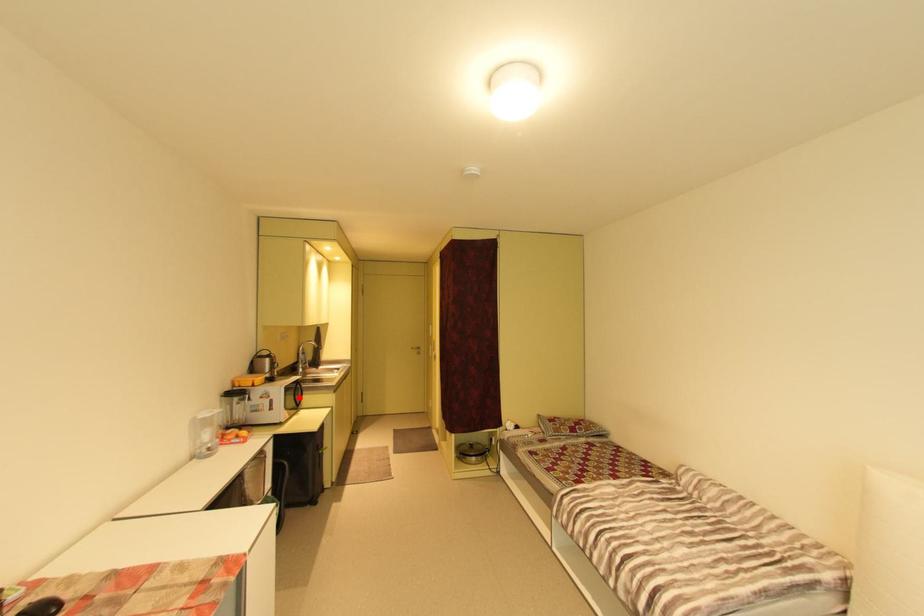
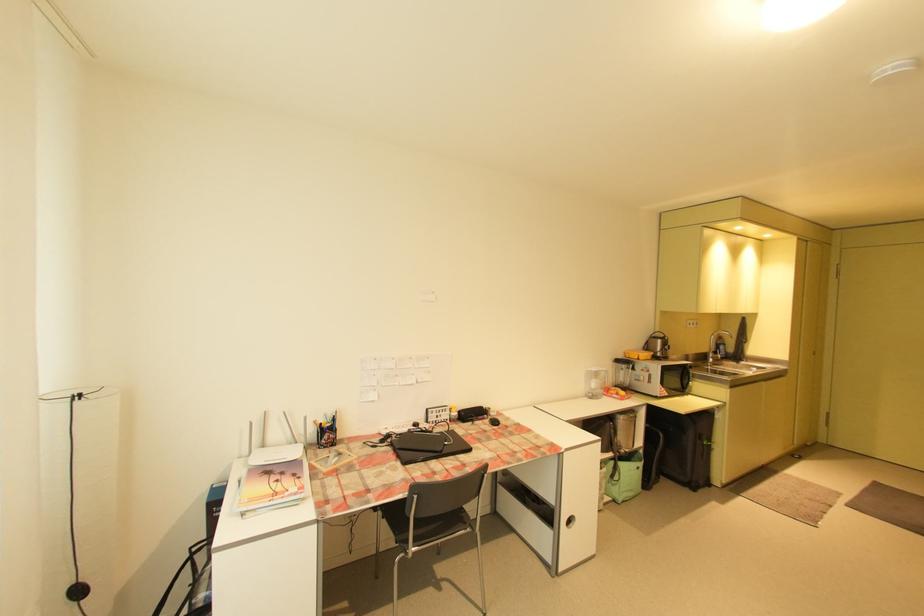
Question: I am providing you with two images of the same scene from different viewpoints. In image1, a red point is highlighted. Considering the same 3D point in image2, which of the following is correct?

Choices:
 (A) It is closer
 (B) It is farther

Answer: (B)